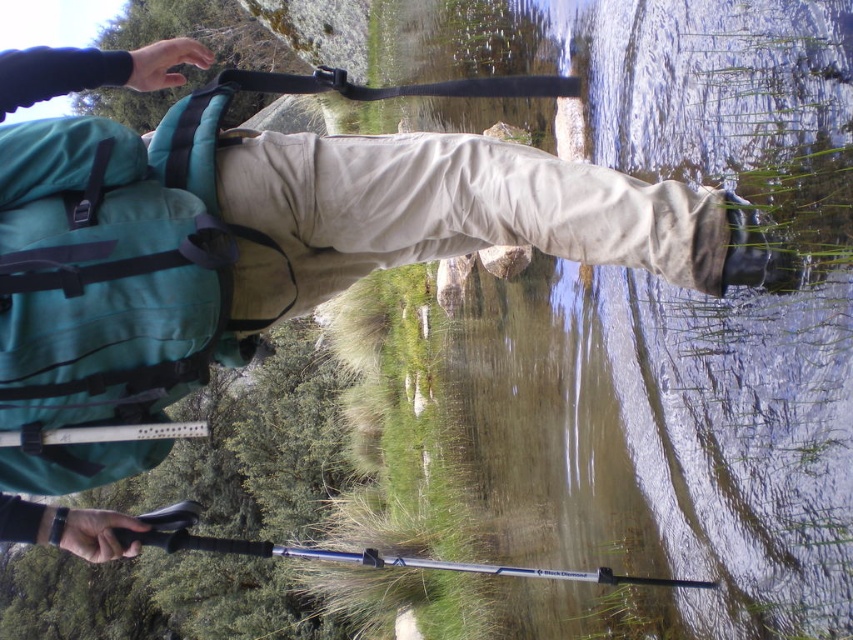
Question: Does teal fabric backpack at left have a lesser width compared to khaki cotton pants at center?

Choices:
 (A) yes
 (B) no

Answer: (A)

Question: Does clear water at lower center have a greater width compared to teal fabric backpack at left?

Choices:
 (A) no
 (B) yes

Answer: (B)

Question: Among these points, which one is nearest to the camera?

Choices:
 (A) (415, 134)
 (B) (137, 186)
 (C) (820, 538)

Answer: (C)

Question: Which object appears closest to the camera in this image?

Choices:
 (A) khaki cotton pants at center
 (B) teal fabric backpack at left

Answer: (B)

Question: Which point is farther to the camera?

Choices:
 (A) clear water at lower center
 (B) teal fabric backpack at left
 (C) khaki cotton pants at center

Answer: (C)

Question: Is teal fabric backpack at left bigger than khaki cotton pants at center?

Choices:
 (A) yes
 (B) no

Answer: (B)